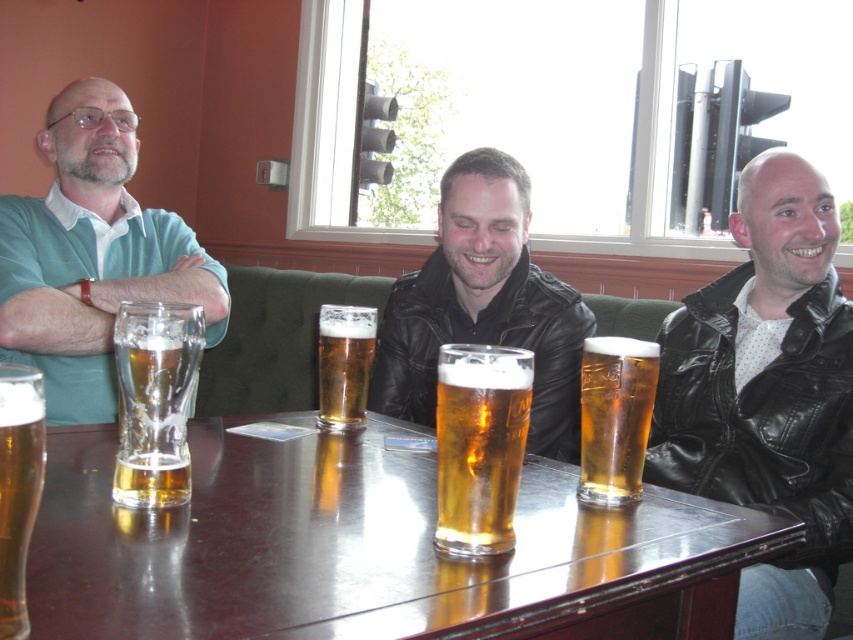
Question: Which point is farther to the camera?

Choices:
 (A) (189, 490)
 (B) (523, 435)
 (C) (24, 224)

Answer: (C)

Question: Does black leather jacket at right appear under clear glass mug at center?

Choices:
 (A) yes
 (B) no

Answer: (A)

Question: Is golden glass at center positioned in front of amber glass at center?

Choices:
 (A) yes
 (B) no

Answer: (A)

Question: Is clear glass mug at center below translucent glass mug at lower left?

Choices:
 (A) no
 (B) yes

Answer: (A)

Question: Estimate the real-world distances between objects in this image. Which object is farther from the matte black leather jacket at center?

Choices:
 (A) golden glass at center
 (B) translucent glass beer at table left
 (C) shiny dark wood table at center
 (D) translucent glass mug at lower left

Answer: (D)

Question: Which object appears closest to the camera in this image?

Choices:
 (A) matte green polo shirt at left
 (B) translucent glass mug at lower left

Answer: (B)